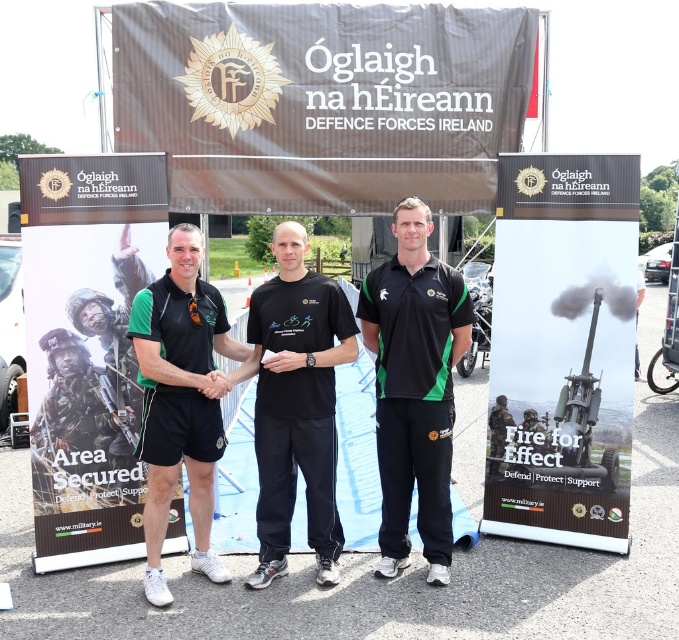
Who is shorter, black matte polo shirt at center or matte black shorts at center?

With less height is matte black shorts at center.

Can you confirm if black matte polo shirt at center is taller than matte black shorts at center?

Correct, black matte polo shirt at center is much taller as matte black shorts at center.

At what (x,y) coordinates should I click in order to perform the action: click on black matte polo shirt at center. Please return your answer as a coordinate pair (x, y). The width and height of the screenshot is (679, 640). Looking at the image, I should click on (414, 387).

I want to click on black matte polo shirt at center, so click(x=414, y=387).

Which of these two, black matte polo shirt at center or black matte t-shirt at center, stands shorter?

With less height is black matte t-shirt at center.

Is black matte polo shirt at center shorter than black matte t-shirt at center?

No.

Locate an element on the screen. This screenshot has width=679, height=640. black matte polo shirt at center is located at coordinates (414, 387).

Does black matte t-shirt at center appear over matte black shorts at center?

Correct, black matte t-shirt at center is located above matte black shorts at center.

Between black matte t-shirt at center and matte black shorts at center, which one appears on the left side from the viewer's perspective?

matte black shorts at center

Is point (274, 548) farther from viewer compared to point (139, 305)?

Yes, point (274, 548) is behind point (139, 305).

Find the location of a particular element. black matte t-shirt at center is located at coordinates (295, 404).